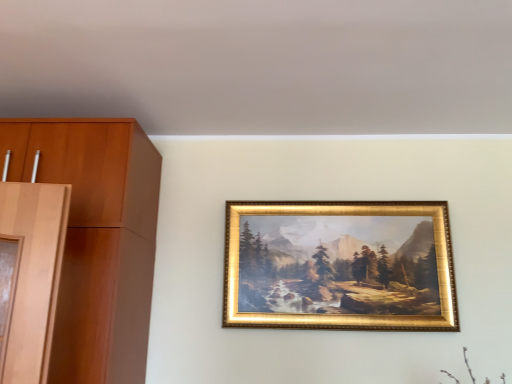
Identify the location of gold metallic frame at center. Image resolution: width=512 pixels, height=384 pixels. (339, 266).

Image resolution: width=512 pixels, height=384 pixels. Describe the element at coordinates (339, 266) in the screenshot. I see `gold metallic frame at center` at that location.

The image size is (512, 384). What do you see at coordinates (97, 239) in the screenshot? I see `wooden cabinet at left` at bounding box center [97, 239].

I want to click on wooden cabinet at left, so click(x=97, y=239).

In order to face wooden cabinet at left, should I rotate leftwards or rightwards?

Turn left by 26.029 degrees to look at wooden cabinet at left.

You are a GUI agent. You are given a task and a screenshot of the screen. Output one action in this format:
    pyautogui.click(x=<x>, y=<y>)
    Task: Click on the gold metallic frame at center
    This screenshot has height=384, width=512.
    Given the screenshot: What is the action you would take?
    pyautogui.click(x=339, y=266)

Is wooden cabinet at left at the right side of gold metallic frame at center?

No.

Which is behind, wooden cabinet at left or gold metallic frame at center?

gold metallic frame at center is more distant.

Which point is more distant from viewer, (142,360) or (352,232)?

The point (352,232) is farther from the camera.

From the image's perspective, which one is positioned higher, wooden cabinet at left or gold metallic frame at center?

wooden cabinet at left.

From a real-world perspective, is wooden cabinet at left over gold metallic frame at center?

Yes, from a real-world perspective, wooden cabinet at left is over gold metallic frame at center

Considering the relative sizes of wooden cabinet at left and gold metallic frame at center in the image provided, is wooden cabinet at left thinner than gold metallic frame at center?

Incorrect, the width of wooden cabinet at left is not less than that of gold metallic frame at center.

Considering the sizes of objects wooden cabinet at left and gold metallic frame at center in the image provided, who is shorter, wooden cabinet at left or gold metallic frame at center?

Standing shorter between the two is gold metallic frame at center.

Consider the image. Who is bigger, wooden cabinet at left or gold metallic frame at center?

wooden cabinet at left is bigger.

Is wooden cabinet at left inside the boundaries of gold metallic frame at center, or outside?

wooden cabinet at left is located beyond the bounds of gold metallic frame at center.

Are wooden cabinet at left and gold metallic frame at center making contact?

No, wooden cabinet at left is not touching gold metallic frame at center.

Is wooden cabinet at left oriented away from gold metallic frame at center?

No, gold metallic frame at center is not at the back of wooden cabinet at left.

How many degrees apart are the facing directions of wooden cabinet at left and gold metallic frame at center?

2.41 degrees.

What are the coordinates of `picture frame on the right side of wooden cabinet at left` in the screenshot? It's located at coord(339,266).

Is gold metallic frame at center at the left side of wooden cabinet at left?

Incorrect, gold metallic frame at center is not on the left side of wooden cabinet at left.

Between gold metallic frame at center and wooden cabinet at left, which one is positioned in front?

wooden cabinet at left is more forward.

Which is nearer, (x=249, y=273) or (x=122, y=240)?

Point (x=249, y=273) is farther from the camera than point (x=122, y=240).

From the image's perspective, would you say gold metallic frame at center is shown under wooden cabinet at left?

Indeed, from the image's perspective, gold metallic frame at center is shown beneath wooden cabinet at left.

From a real-world perspective, is gold metallic frame at center positioned above or below wooden cabinet at left?

In terms of real-world spatial position, gold metallic frame at center is below wooden cabinet at left.

Which of these two, gold metallic frame at center or wooden cabinet at left, is thinner?

Thinner between the two is gold metallic frame at center.

Is gold metallic frame at center shorter than wooden cabinet at left?

Correct, gold metallic frame at center is not as tall as wooden cabinet at left.

In the scene shown: Who is bigger, gold metallic frame at center or wooden cabinet at left?

wooden cabinet at left.

Do you think gold metallic frame at center is within wooden cabinet at left, or outside of it?

The correct answer is: outside.

Does gold metallic frame at center touch wooden cabinet at left?

No.

Does gold metallic frame at center turn towards wooden cabinet at left?

No.

Where is `cabinetry above the gold metallic frame at center (from the image's perspective)`? The image size is (512, 384). cabinetry above the gold metallic frame at center (from the image's perspective) is located at coordinates (97, 239).

At what (x,y) coordinates should I click in order to perform the action: click on picture frame below the wooden cabinet at left (from the image's perspective). Please return your answer as a coordinate pair (x, y). This screenshot has height=384, width=512. Looking at the image, I should click on (339, 266).

Where is `cabinetry that appears on the left of gold metallic frame at center`? This screenshot has width=512, height=384. cabinetry that appears on the left of gold metallic frame at center is located at coordinates (97, 239).